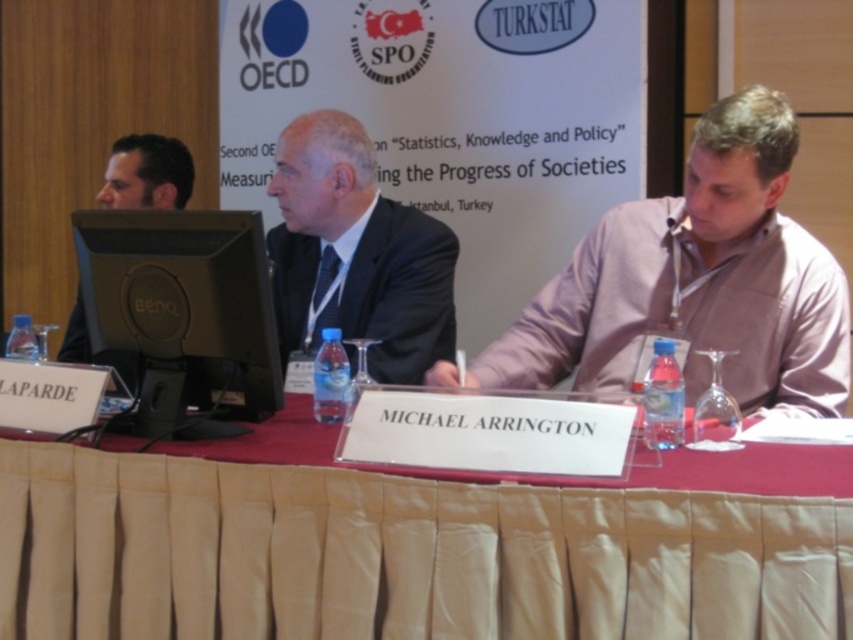
You are organizing a presentation and need to place a laptop between the beige fabric tablecloth at center and the black glossy monitor at center. Which side of the monitor should you place the laptop on?

The beige fabric tablecloth at center is positioned on the right side of the black glossy monitor at center, so you should place the laptop to the left of the monitor to keep it between the two objects.

From the picture: You are organizing a presentation and need to place a 12x12 inch square poster on the table. Given the beige fabric tablecloth at center and the black glossy monitor at center, which object will the poster fit on better?

The beige fabric tablecloth at center has a larger size compared to the black glossy monitor at center, so the poster will fit better on the beige fabric tablecloth at center.

You are a photographer adjusting your camera to focus on two points on the table. The first point is at coordinates point [229,218] and the second point is at point [132,385]. Since you can only focus on one point at a time, which point should you choose to ensure that both points remain in focus?

You should focus on point [132,385] because it is farther from the camera, and focusing on the farther point will keep both points in focus due to the depth of field.